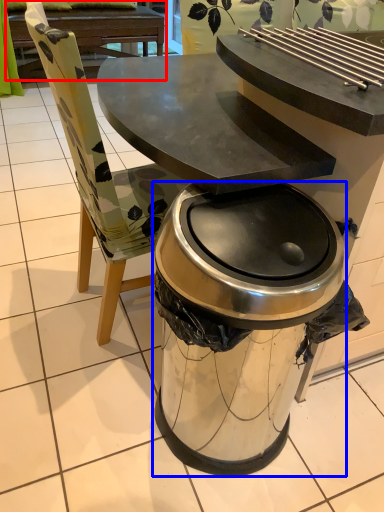
Question: Which object is closer to the camera taking this photo, picnic table (highlighted by a red box) or trash bin/can (highlighted by a blue box)?

Choices:
 (A) picnic table
 (B) trash bin/can

Answer: (B)